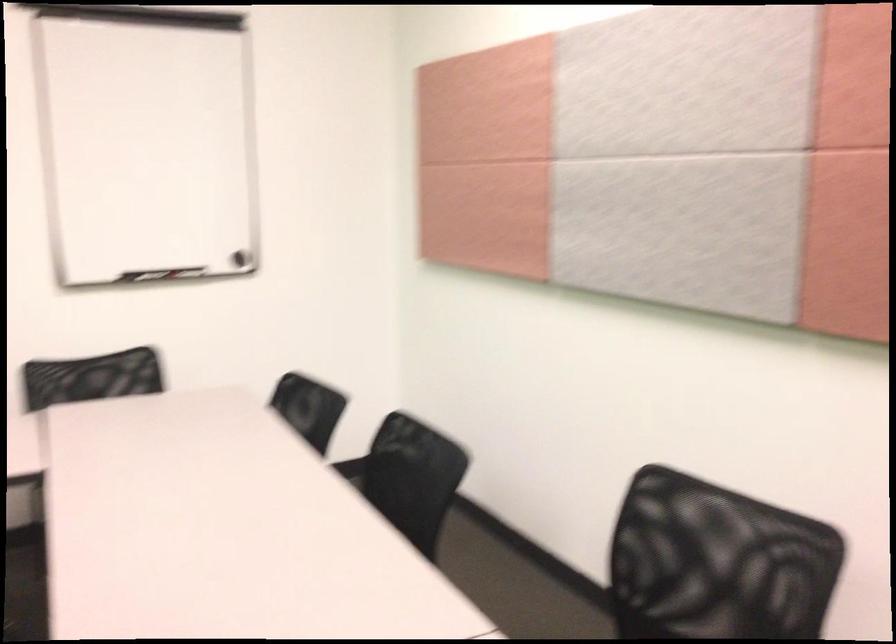
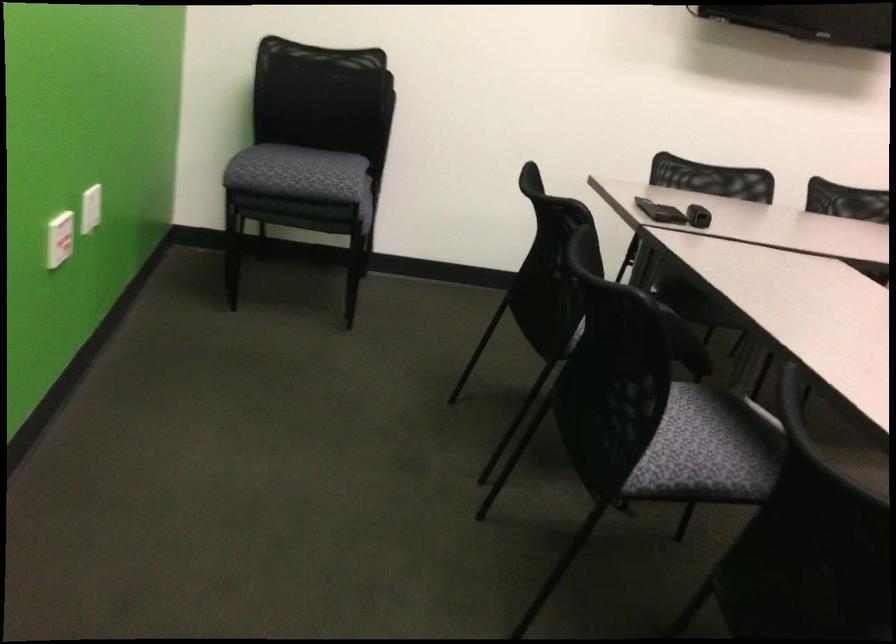
The images are taken continuously from a first-person perspective. In which direction are you moving?

The movement direction of the cameraman is left, backward.